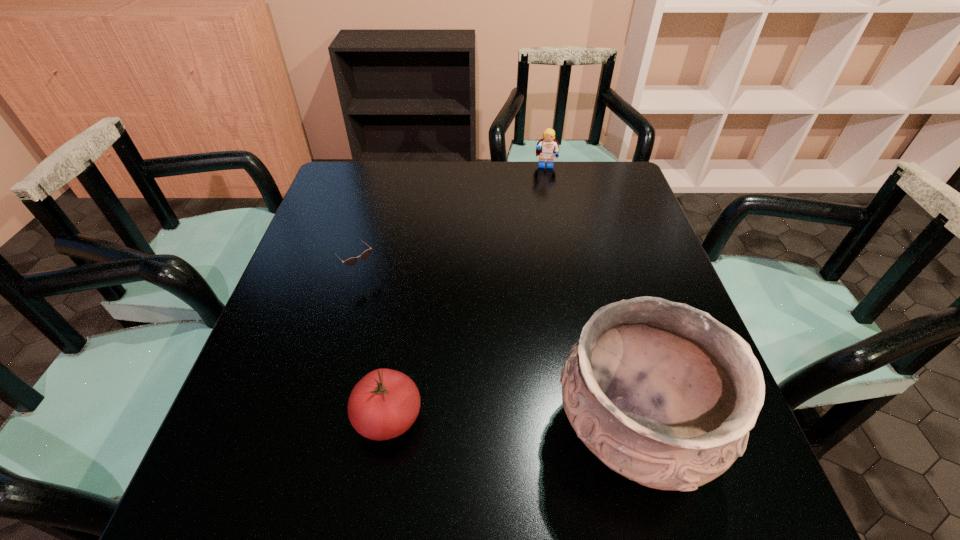
Where is `tomato`? tomato is located at coordinates (384, 404).

Where is `pottery`? This screenshot has width=960, height=540. pottery is located at coordinates (662, 393).

Identify the location of the shortest object. Image resolution: width=960 pixels, height=540 pixels. (350, 262).

Identify the location of the third nearest object. This screenshot has width=960, height=540. (350, 262).

In order to click on the farthest object in this screenshot , I will do `click(548, 148)`.

You are a GUI agent. You are given a task and a screenshot of the screen. Output one action in this format:
    pyautogui.click(x=<x>, y=<y>)
    Task: Click on the vacant space situated 0.140m on the left of the tomato
    
    Given the screenshot: What is the action you would take?
    278,417

You are a GUI agent. You are given a task and a screenshot of the screen. Output one action in this format:
    pyautogui.click(x=<x>, y=<y>)
    Task: Click on the vacant region located on the left of the tallest object
    The height and width of the screenshot is (540, 960).
    Given the screenshot: What is the action you would take?
    pyautogui.click(x=492, y=431)

The width and height of the screenshot is (960, 540). What are the coordinates of `vacant space situated in front of the lenses of the shortest object` in the screenshot? It's located at point(487,403).

Where is `vacant area situated in front of the lenses of the shortest object`? vacant area situated in front of the lenses of the shortest object is located at coordinates (425, 339).

Locate an element on the screen. blank area located in front of the lenses of the shortest object is located at coordinates (480, 396).